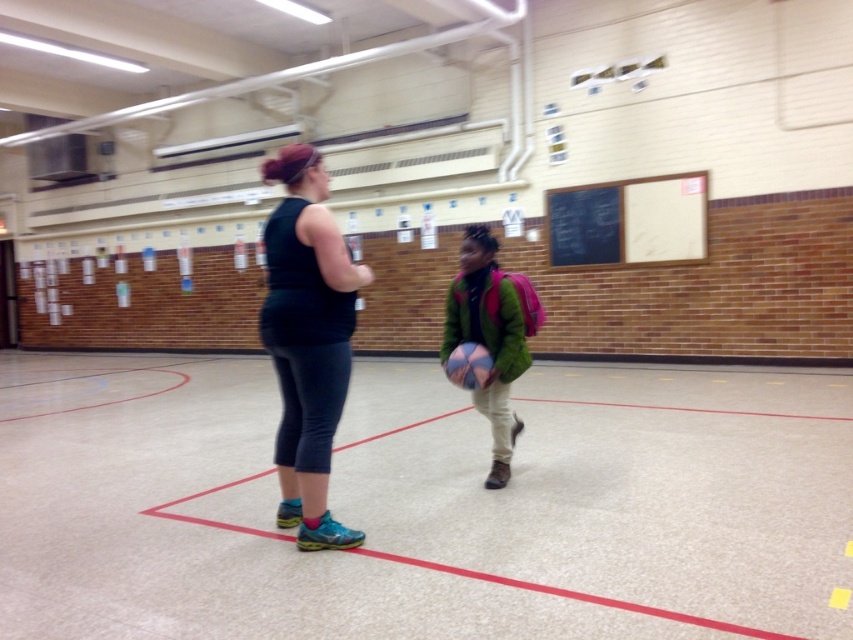
Question: Is black matte leggings at center smaller than black chalkboard at upper right?

Choices:
 (A) no
 (B) yes

Answer: (B)

Question: Which is farther from the multicolored fabric basketball at center?

Choices:
 (A) black chalkboard at upper right
 (B) green fuzzy jacket at center
 (C) black matte leggings at center

Answer: (A)

Question: Considering the real-world distances, which object is farthest from the multicolored fabric basketball at center?

Choices:
 (A) green fuzzy jacket at center
 (B) black matte leggings at center

Answer: (B)

Question: Considering the relative positions of black chalkboard at upper right and green fuzzy jacket at center in the image provided, where is black chalkboard at upper right located with respect to green fuzzy jacket at center?

Choices:
 (A) above
 (B) below

Answer: (A)

Question: Among these objects, which one is farthest from the camera?

Choices:
 (A) green fuzzy jacket at center
 (B) black chalkboard at upper right
 (C) multicolored fabric basketball at center
 (D) black matte leggings at center

Answer: (B)

Question: Can you confirm if black chalkboard at upper right is positioned to the left of green fuzzy jacket at center?

Choices:
 (A) yes
 (B) no

Answer: (B)